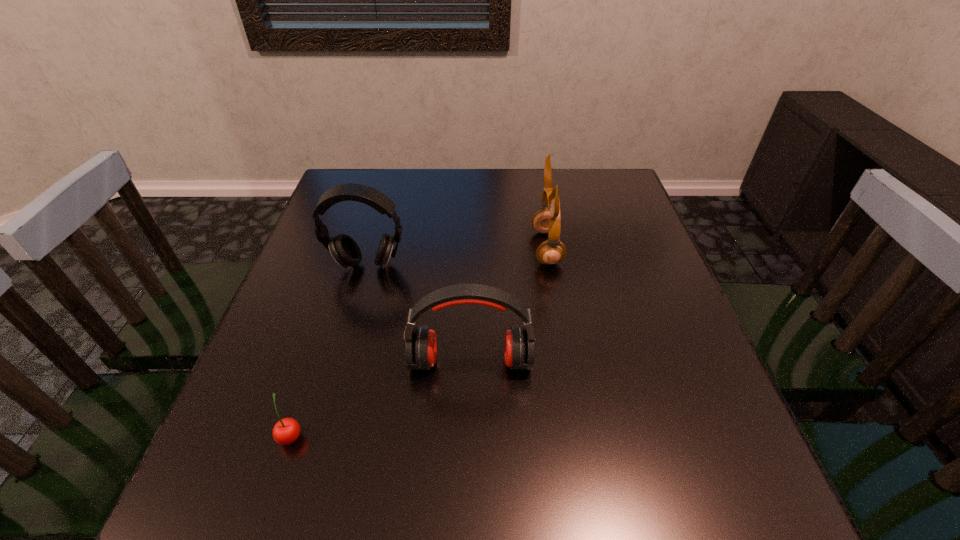
Identify the location of earphone object that ranks as the closest to the leftmost earphone. (421, 344).

Identify which earphone is the second nearest to the rightmost object. Please provide its 2D coordinates. Your answer should be formatted as a tuple, i.e. [(x, y)], where the tuple contains the x and y coordinates of a point satisfying the conditions above.

[(346, 252)]

Where is `blank space that satisfies the following two spatial constraints: 1. on the front-facing side of the rightmost object; 2. on the ear cups of the leftmost earphone`? The height and width of the screenshot is (540, 960). blank space that satisfies the following two spatial constraints: 1. on the front-facing side of the rightmost object; 2. on the ear cups of the leftmost earphone is located at coordinates (550, 265).

Where is `free space that satisfies the following two spatial constraints: 1. on the front-facing side of the rightmost earphone; 2. on the ear cups of the second earphone from left to right`? This screenshot has height=540, width=960. free space that satisfies the following two spatial constraints: 1. on the front-facing side of the rightmost earphone; 2. on the ear cups of the second earphone from left to right is located at coordinates (566, 361).

What are the coordinates of `vacant space that satisfies the following two spatial constraints: 1. on the front-facing side of the rightmost object; 2. on the ear cups of the second earphone from left to right` in the screenshot? It's located at (566, 361).

Find the location of a particular element. vacant space that satisfies the following two spatial constraints: 1. on the front-facing side of the rightmost object; 2. on the front side of the nearest object is located at coordinates (579, 435).

Where is `vacant space that satisfies the following two spatial constraints: 1. on the front-facing side of the rightmost earphone; 2. on the ear cups of the third object from left to right`? vacant space that satisfies the following two spatial constraints: 1. on the front-facing side of the rightmost earphone; 2. on the ear cups of the third object from left to right is located at coordinates (566, 361).